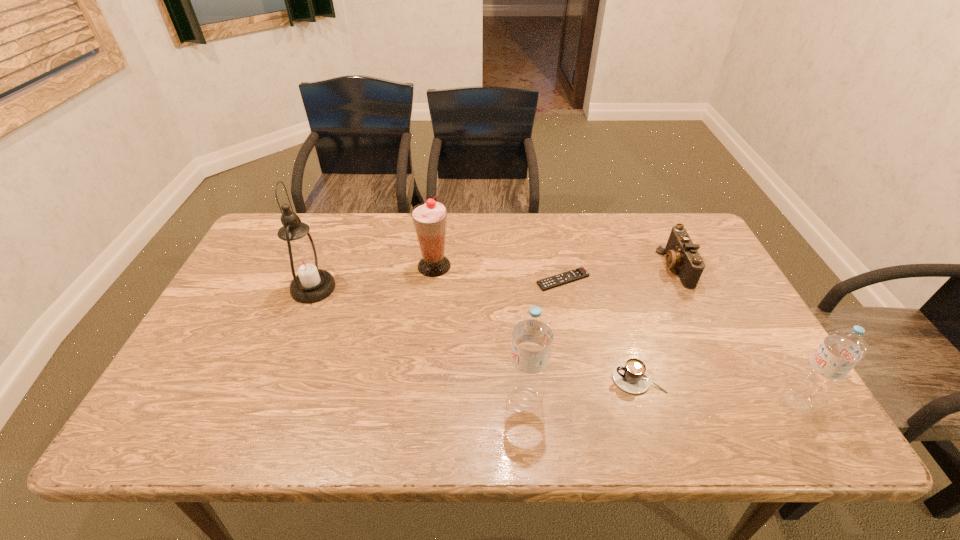
In order to click on free location at the left edge of the desktop in this screenshot , I will do `click(244, 260)`.

In the image, there is a desktop. At what (x,y) coordinates should I click in order to perform the action: click on vacant space at the far left corner. Please return your answer as a coordinate pair (x, y). The image size is (960, 540). Looking at the image, I should click on (277, 231).

The height and width of the screenshot is (540, 960). Identify the location of vacant space at the near right corner. (723, 390).

Image resolution: width=960 pixels, height=540 pixels. Identify the location of free spot between the leftmost object and the left water bottle. (419, 345).

The width and height of the screenshot is (960, 540). I want to click on vacant area that lies between the sixth object from right to left and the remote control, so click(x=498, y=273).

Find the location of a particular element. This screenshot has height=540, width=960. vacant space that's between the rightmost object and the leftmost object is located at coordinates pos(555,345).

Where is `blank region between the rightmost object and the leftmost object`? The image size is (960, 540). blank region between the rightmost object and the leftmost object is located at coordinates (555, 345).

What are the coordinates of `free space between the rightmost object and the sixth tallest object` in the screenshot? It's located at (717, 390).

I want to click on unoccupied position between the oil lamp and the second shortest object, so click(x=475, y=334).

Where is `empty space that is in between the oil lamp and the sixth object from right to left`? empty space that is in between the oil lamp and the sixth object from right to left is located at coordinates (373, 277).